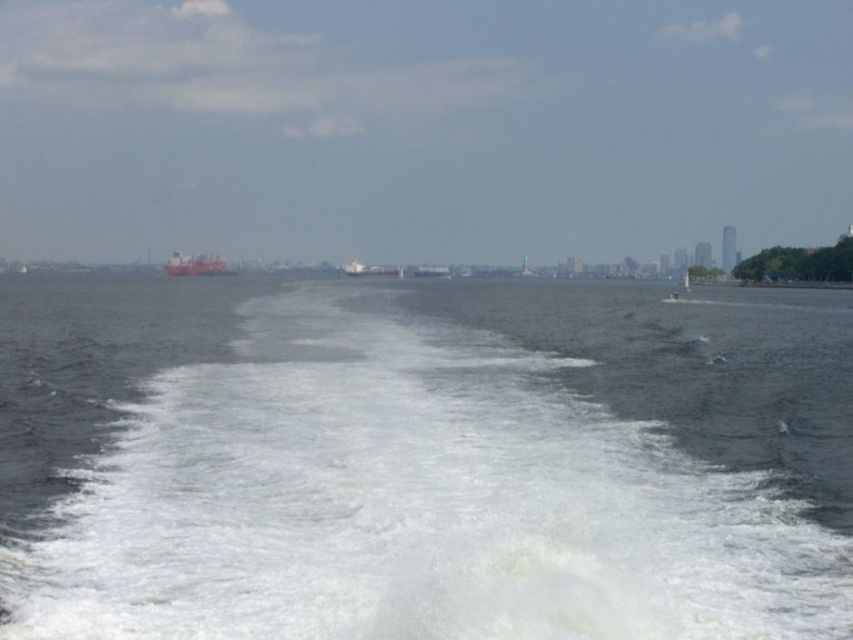
Question: Which point is farther from the camera taking this photo?

Choices:
 (A) (213, 257)
 (B) (566, 307)

Answer: (A)

Question: Is white foamy water at center positioned in front of red matte cargo ship at center?

Choices:
 (A) yes
 (B) no

Answer: (A)

Question: Can you confirm if white foamy water at center is smaller than red matte cargo ship at center?

Choices:
 (A) yes
 (B) no

Answer: (B)

Question: Which point is closer to the camera?

Choices:
 (A) red matte cargo ship at center
 (B) white foamy water at center

Answer: (B)

Question: Is white foamy water at center positioned behind red matte cargo ship at center?

Choices:
 (A) yes
 (B) no

Answer: (B)